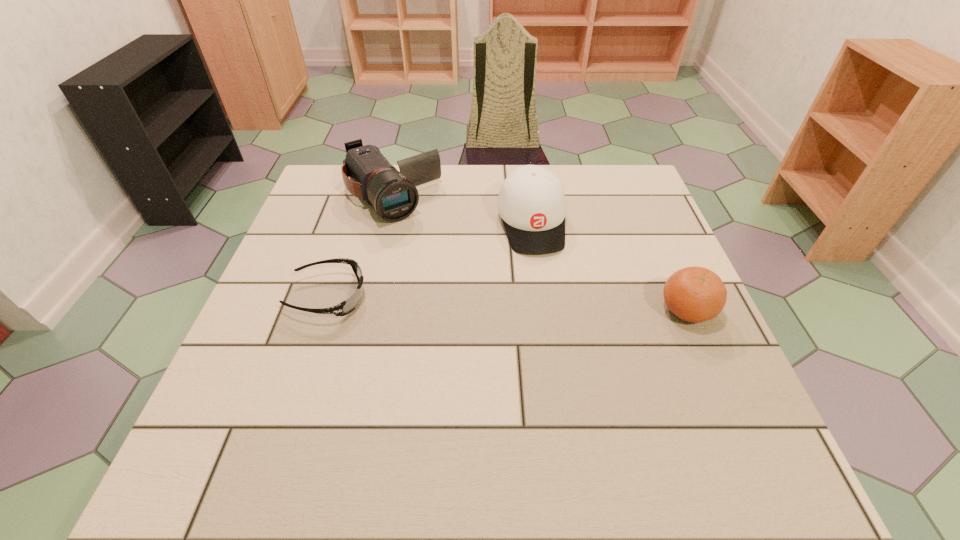
The image size is (960, 540). What are the coordinates of `sunglasses` in the screenshot? It's located at (345, 307).

Image resolution: width=960 pixels, height=540 pixels. I want to click on the second shortest object, so click(694, 294).

Locate an element on the screen. The image size is (960, 540). the rightmost object is located at coordinates (694, 294).

This screenshot has height=540, width=960. Identify the location of camcorder. (394, 195).

I want to click on baseball cap, so click(531, 203).

Where is `free space located on the lenses of the shortest object`? This screenshot has height=540, width=960. free space located on the lenses of the shortest object is located at coordinates (408, 296).

This screenshot has width=960, height=540. What are the coordinates of `free point located 0.170m on the left of the rightmost object` in the screenshot? It's located at (580, 310).

Find the location of a particular element. free space located 0.200m on the lens of the camcorder is located at coordinates (448, 268).

Locate an element on the screen. This screenshot has height=540, width=960. free space located 0.080m on the lens of the camcorder is located at coordinates (426, 240).

You are a GUI agent. You are given a task and a screenshot of the screen. Output one action in this format:
    pyautogui.click(x=<x>, y=<y>)
    Task: Click on the vacant space situated 0.220m on the lens of the camcorder
    This screenshot has height=540, width=960.
    Given the screenshot: What is the action you would take?
    pyautogui.click(x=453, y=274)